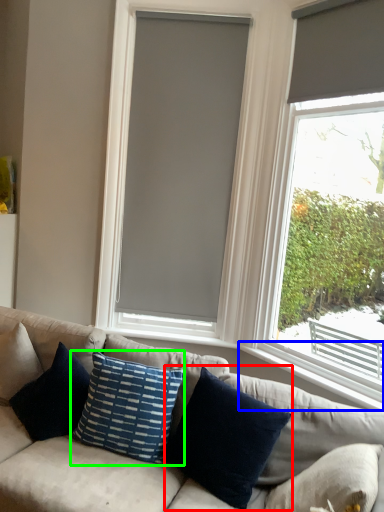
Question: Which object is the farthest from pillow (highlighted by a red box)? Choose among these: window sill (highlighted by a blue box) or pillow (highlighted by a green box).

Choices:
 (A) window sill
 (B) pillow

Answer: (A)